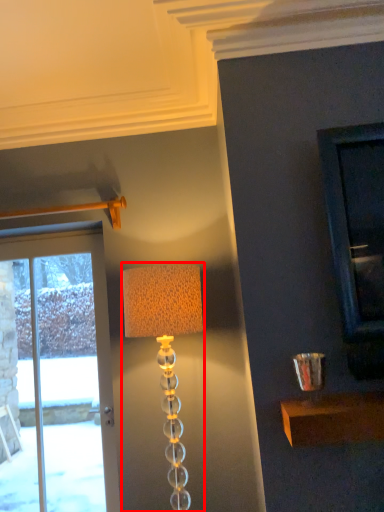
Question: Where is lamp (annotated by the red box) located in relation to door in the image?

Choices:
 (A) right
 (B) left

Answer: (A)